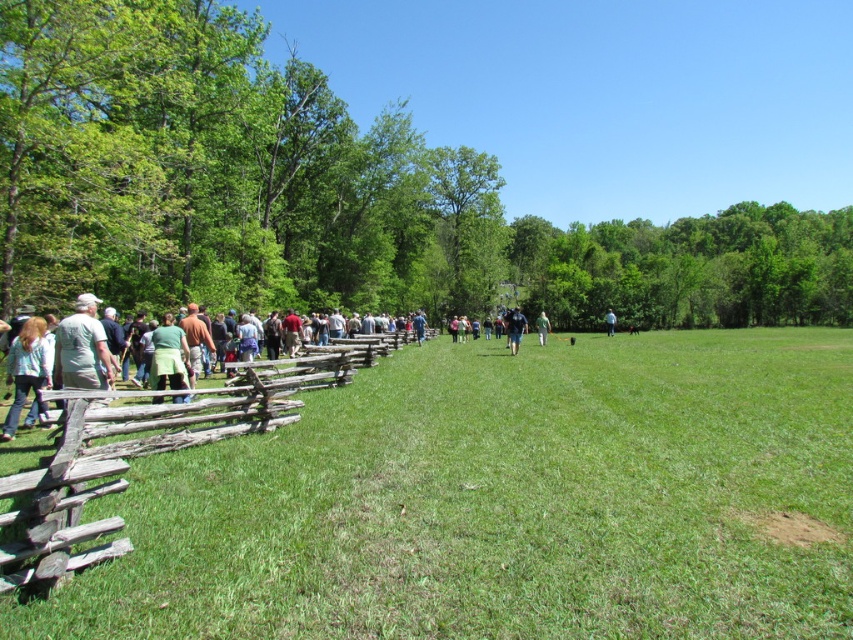
You are a painter wanting to capture the scene. You notice the green grassy field at left and the weathered wood fence at left. Which object would you say is shorter in height?

The green grassy field at left is not as tall as the weathered wood fence at left, so the green grassy field at left is shorter in height.

You are planning to set up a picnic blanket in the image. The picnic blanket is 2 meters wide. Which object from the scene can you place it next to without it overlapping? The options are the green grassy field at left and the green fabric apron at center.

The picnic blanket can be placed next to the green grassy field at left because it is larger than the green fabric apron at center, providing enough space for the 2 meter wide blanket.